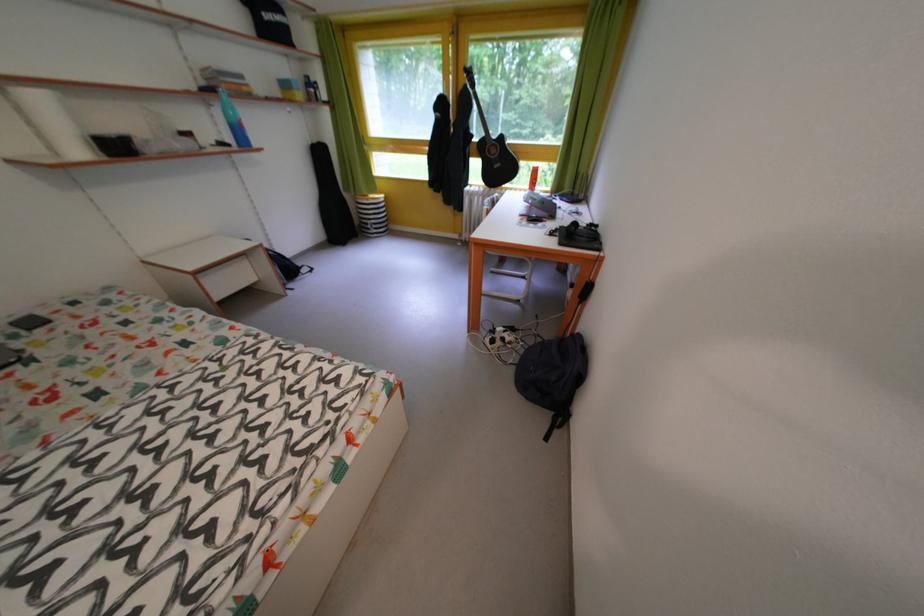
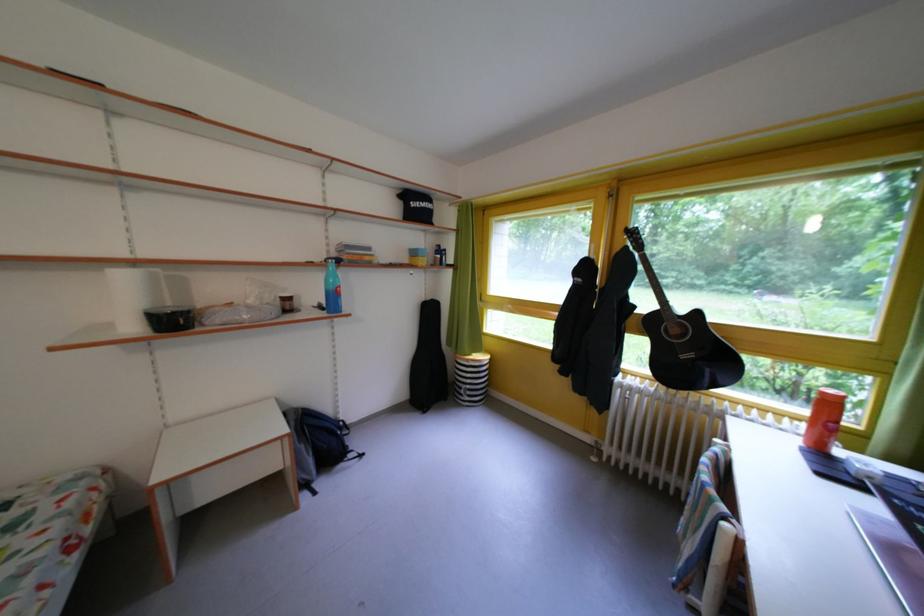
In the second image, find the point that corresponds to pixel 505 172 in the first image.

(693, 362)